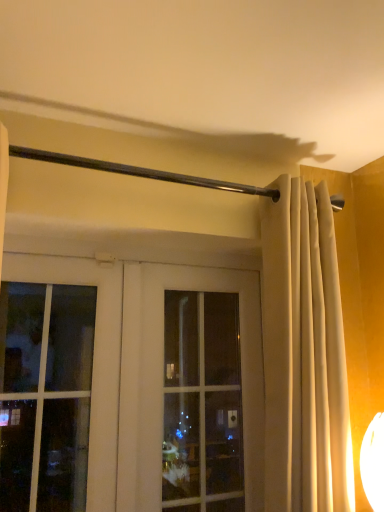
Question: Considering the positions of clear glass window at center and white glass door at center in the image, is clear glass window at center wider or thinner than white glass door at center?

Choices:
 (A) thin
 (B) wide

Answer: (B)

Question: From the image's perspective, is clear glass window at center above or below white glass door at center?

Choices:
 (A) above
 (B) below

Answer: (B)

Question: Estimate the real-world distances between objects in this image. Which object is closer to the white glass door at center?

Choices:
 (A) beige fabric curtain at center
 (B) clear glass window at center

Answer: (B)

Question: Estimate the real-world distances between objects in this image. Which object is farther from the clear glass window at center?

Choices:
 (A) white glass door at center
 (B) beige fabric curtain at center

Answer: (B)